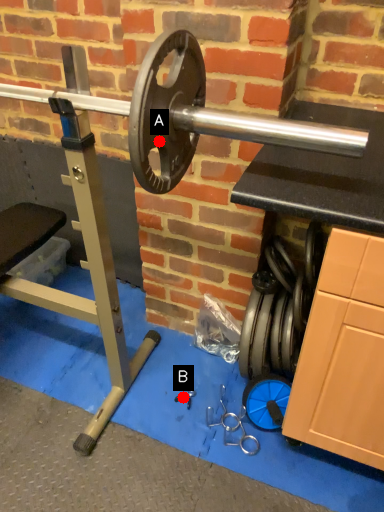
Question: Two points are circled on the image, labeled by A and B beside each circle. Which point is further to the camera?

Choices:
 (A) A is further
 (B) B is further

Answer: (B)